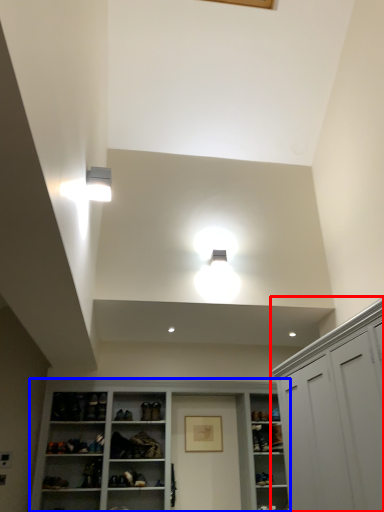
Question: Which object appears farthest to the camera in this image, cabinetry (highlighted by a red box) or cupboard (highlighted by a blue box)?

Choices:
 (A) cabinetry
 (B) cupboard

Answer: (B)